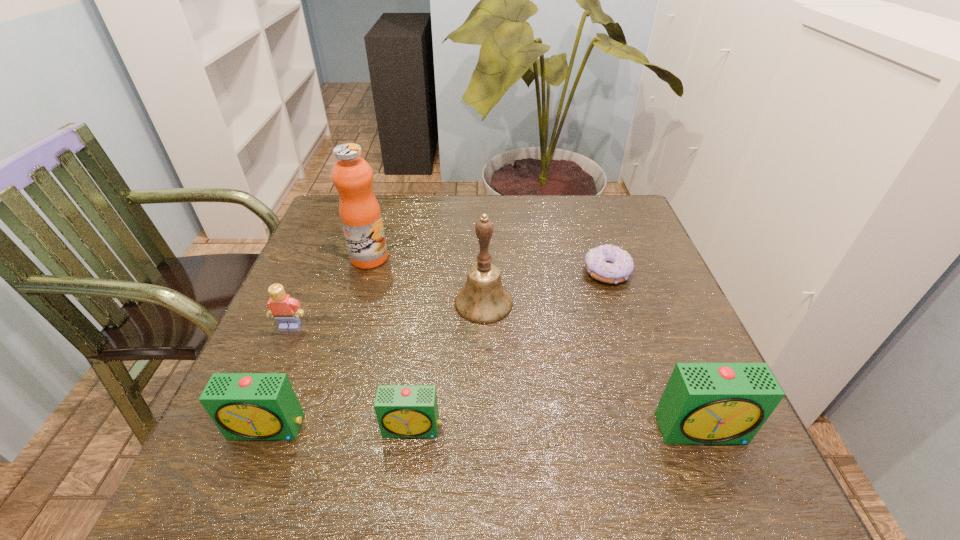
This screenshot has height=540, width=960. I want to click on object situated at the near right corner, so click(x=703, y=403).

The width and height of the screenshot is (960, 540). Identify the location of vacant space at the far edge of the desktop. (536, 202).

In the image, there is a desktop. Where is `blank space at the near edge`? The width and height of the screenshot is (960, 540). blank space at the near edge is located at coordinates (479, 416).

I want to click on free spot at the left edge of the desktop, so click(x=334, y=271).

The width and height of the screenshot is (960, 540). In the image, there is a desktop. Identify the location of vacant space at the right edge. (617, 245).

In the image, there is a desktop. At what (x,y) coordinates should I click in order to perform the action: click on vacant space at the far right corner. Please return your answer as a coordinate pair (x, y). Looking at the image, I should click on (582, 220).

The height and width of the screenshot is (540, 960). Find the location of `vacant area between the tallest object and the second shortest alarm clock`. vacant area between the tallest object and the second shortest alarm clock is located at coordinates (319, 343).

The width and height of the screenshot is (960, 540). I want to click on vacant area between the sixth shortest object and the second alarm clock from left to right, so (x=448, y=366).

Identify the location of vacant area that lies between the fourth object from left to right and the shortest object. (510, 350).

The width and height of the screenshot is (960, 540). Identify the location of vacant region between the rightmost alarm clock and the shortest alarm clock. (558, 429).